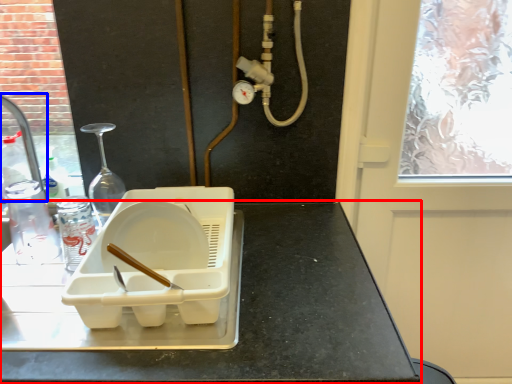
Question: Among these objects, which one is nearest to the camera, countertop (highlighted by a red box) or faucet (highlighted by a blue box)?

Choices:
 (A) countertop
 (B) faucet

Answer: (A)